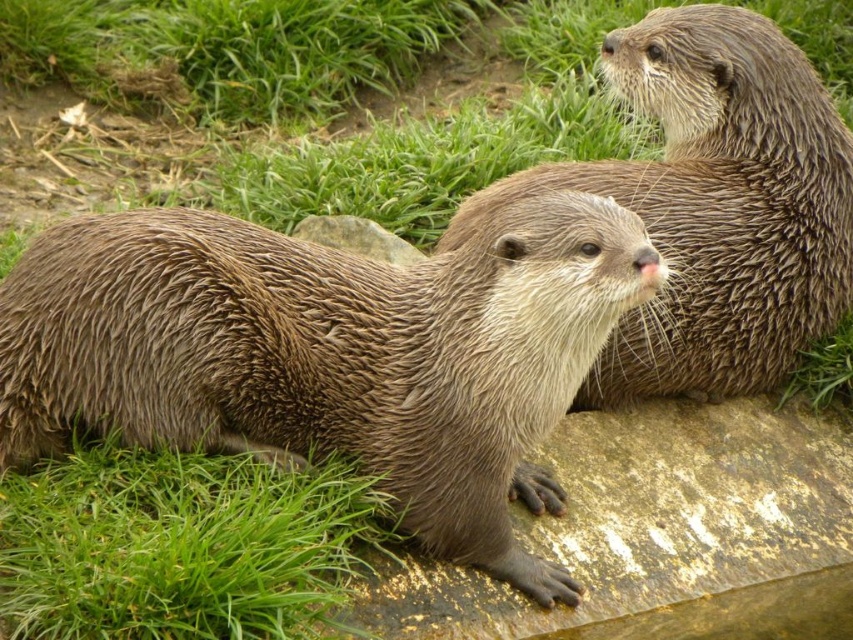
Question: Which point is closer to the camera?

Choices:
 (A) (49, 4)
 (B) (143, 214)

Answer: (B)

Question: Does wet fur otter at center have a larger size compared to green grass at upper left?

Choices:
 (A) no
 (B) yes

Answer: (A)

Question: Does wet fur otter at center appear under brown fur otter at upper right?

Choices:
 (A) yes
 (B) no

Answer: (A)

Question: Based on their relative distances, which object is farther from the wet fur otter at center?

Choices:
 (A) brown fur otter at upper right
 (B) green grass at lower left

Answer: (A)

Question: Which point is farther to the camera?

Choices:
 (A) wet fur otter at center
 (B) green grass at upper left
 (C) green grass at lower left
 (D) brown fur otter at upper right

Answer: (B)

Question: Can you confirm if green grass at lower left is smaller than green grass at upper left?

Choices:
 (A) no
 (B) yes

Answer: (B)